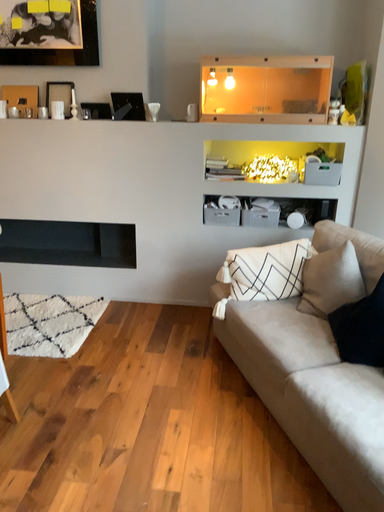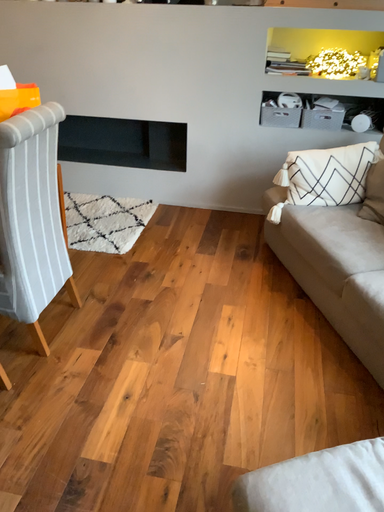
Question: Which way did the camera rotate in the video?

Choices:
 (A) rotated downward
 (B) rotated upward

Answer: (A)